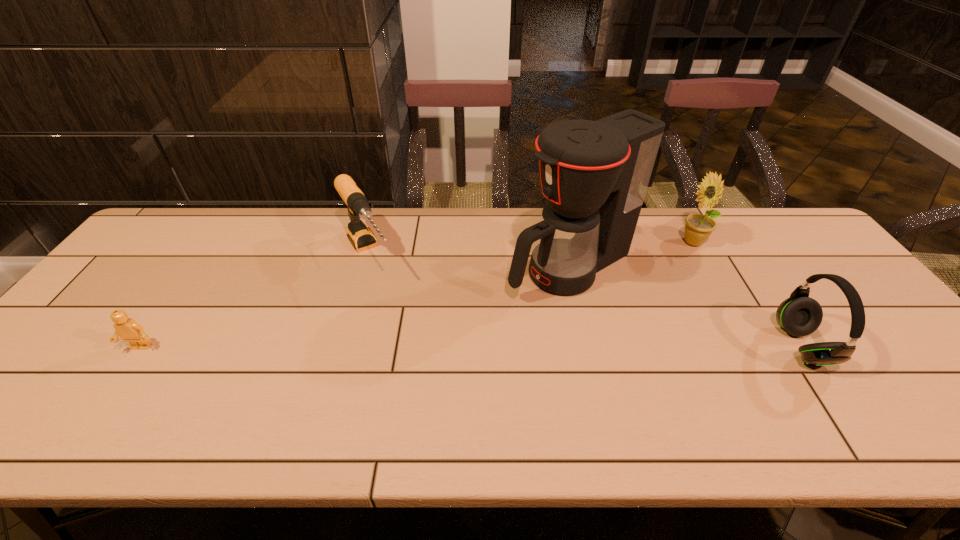
Image resolution: width=960 pixels, height=540 pixels. What are the coordinates of `vacant position located 0.060m pour from the carafe of the coffee maker` in the screenshot? It's located at (502, 298).

This screenshot has width=960, height=540. In order to click on free space located pour from the carafe of the coffee maker in this screenshot , I will do tap(496, 301).

You are a GUI agent. You are given a task and a screenshot of the screen. Output one action in this format:
    pyautogui.click(x=<x>, y=<y>)
    Task: Click on the free space located on the face of the second object from right to left
    
    Given the screenshot: What is the action you would take?
    pyautogui.click(x=635, y=294)

Locate an element on the screen. Image resolution: width=960 pixels, height=540 pixels. vacant space situated on the face of the second object from right to left is located at coordinates 655,278.

Locate an element on the screen. Image resolution: width=960 pixels, height=540 pixels. vacant space located 0.260m on the face of the second object from right to left is located at coordinates (638, 291).

You are a GUI agent. You are given a task and a screenshot of the screen. Output one action in this format:
    pyautogui.click(x=<x>, y=<y>)
    Task: Click on the vacant area situated 0.350m on the handle side of the second object from left to right
    Image resolution: width=960 pixels, height=540 pixels.
    Given the screenshot: What is the action you would take?
    pyautogui.click(x=435, y=373)

Identify the location of free region located 0.320m on the handle side of the second object from left to right. Image resolution: width=960 pixels, height=540 pixels. pos(429,363).

At what (x,y) coordinates should I click in order to perform the action: click on vacant space positioned on the handle side of the second object from left to right. Please return your answer as a coordinate pair (x, y). Looking at the image, I should click on (433, 369).

At what (x,y) coordinates should I click in order to perform the action: click on coffee maker situated at the far edge. Please return your answer as a coordinate pair (x, y). The image size is (960, 540). Looking at the image, I should click on (594, 175).

Locate an element on the screen. The image size is (960, 540). sunflower positioned at the far edge is located at coordinates (x=698, y=227).